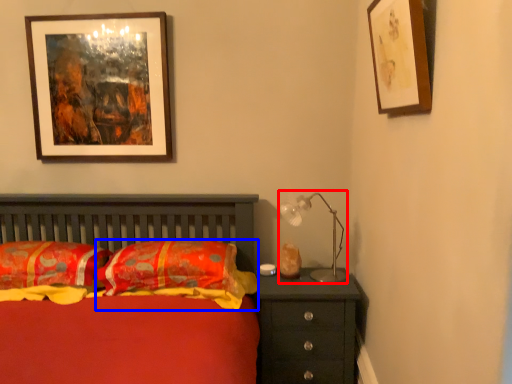
Question: Which object is closer to the camera taking this photo, table lamp (highlighted by a red box) or pillow (highlighted by a blue box)?

Choices:
 (A) table lamp
 (B) pillow

Answer: (B)